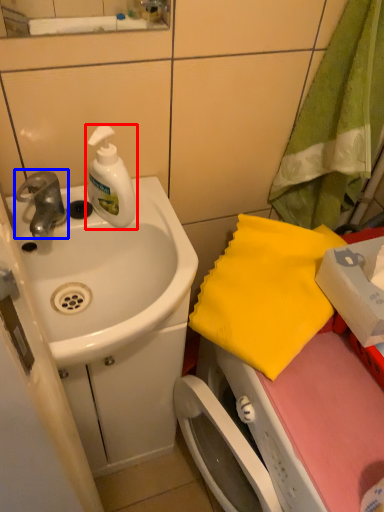
Question: Which point is closer to the camera, soap dispenser (highlighted by a red box) or tap (highlighted by a blue box)?

Choices:
 (A) soap dispenser
 (B) tap

Answer: (A)